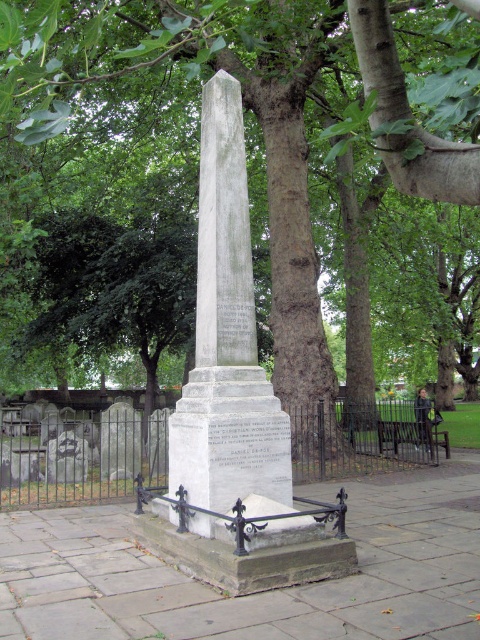
Locate an element on the screen. The image size is (480, 640). green leafy tree at center is located at coordinates (156, 182).

Is white marble obelisk at center positioned behind wooden park bench at center?

No, white marble obelisk at center is in front of wooden park bench at center.

Where is `white marble obelisk at center`? This screenshot has height=640, width=480. white marble obelisk at center is located at coordinates click(x=227, y=339).

Between green leafy tree at center and white marble obelisk at center, which one has less height?

Standing shorter between the two is white marble obelisk at center.

Who is lower down, green leafy tree at center or white marble obelisk at center?

white marble obelisk at center is lower down.

Between point (251, 84) and point (193, 520), which one is positioned in front?

Positioned in front is point (193, 520).

In order to click on green leafy tree at center in this screenshot , I will do `click(156, 182)`.